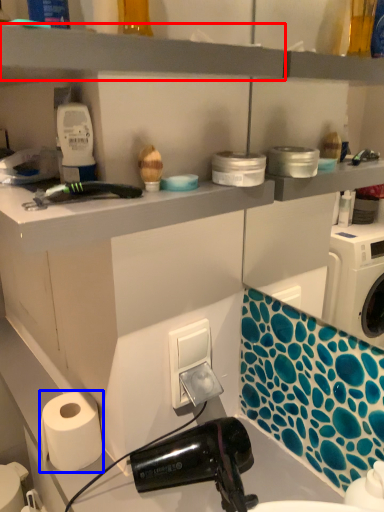
Question: Which point is closer to the camera, shelf (highlighted by a red box) or paper towel (highlighted by a blue box)?

Choices:
 (A) shelf
 (B) paper towel

Answer: (A)